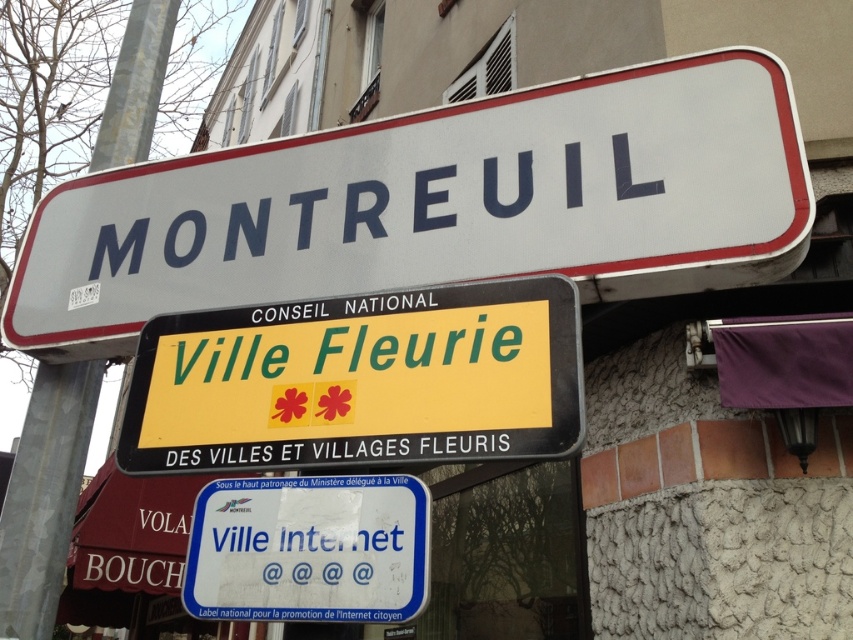
You are standing on the sidewalk looking at the street signboard. There is a point marked at coordinates (437, 205). What object is located at that point?

The point at coordinates (437, 205) indicates the white plastic street sign at upper center.

You are standing at the street signboard in Montreuil. You need to reach a point that is exactly 1 meter away from the camera. Is the point at coordinates point (201, 506) within that 1 meter range?

The point at coordinates point (201, 506) is 1.12 meters away from the camera, which is slightly beyond the 1 meter range. Therefore, it is not within the desired distance.

You are a city planner assessing the street signs. The white plastic street sign at upper center and the blue plastic sign at center are both important for navigation. Which of these two signs is wider?

The white plastic street sign at upper center is wider than the blue plastic sign at center, as its width surpasses the blue plastic sign at center.